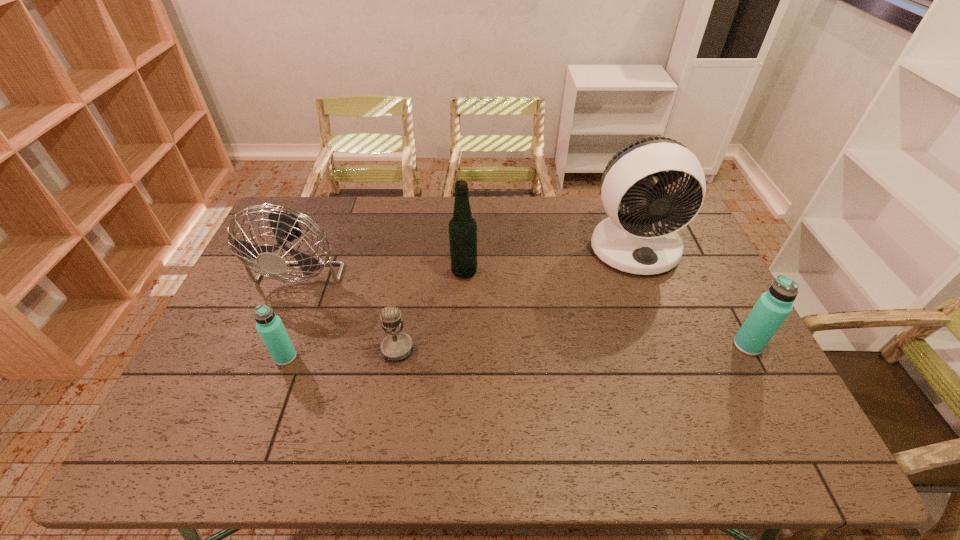
Where is `the shorter thermos bottle`? The height and width of the screenshot is (540, 960). the shorter thermos bottle is located at coordinates (269, 325).

Where is `the taller thermos bottle`? This screenshot has width=960, height=540. the taller thermos bottle is located at coordinates (772, 308).

You are a GUI agent. You are given a task and a screenshot of the screen. Output one action in this format:
    pyautogui.click(x=<x>, y=<y>)
    Task: Click on the rightmost object
    
    Given the screenshot: What is the action you would take?
    pyautogui.click(x=772, y=308)

You are a GUI agent. You are given a task and a screenshot of the screen. Output one action in this format:
    pyautogui.click(x=<x>, y=<y>)
    Task: Click on the alcohol
    
    Given the screenshot: What is the action you would take?
    pyautogui.click(x=462, y=227)

Locate an element on the screen. The height and width of the screenshot is (540, 960). the shorter fan is located at coordinates (285, 226).

I want to click on the right fan, so click(x=646, y=242).

Find the location of a particular element. This screenshot has width=960, height=540. the fifth object from left to right is located at coordinates (646, 242).

The image size is (960, 540). I want to click on the third object from left to right, so click(396, 346).

The image size is (960, 540). What are the coordinates of `the shortest object` in the screenshot? It's located at (396, 346).

Identify the location of free spot located 0.050m on the back of the left thermos bottle. This screenshot has width=960, height=540. (295, 333).